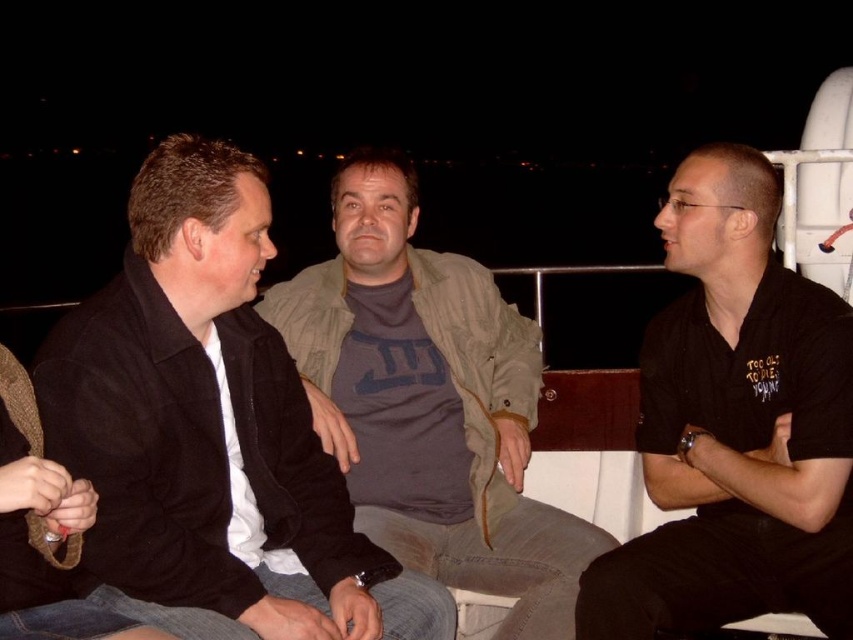
Question: Does black matte shirt at center appear under dark gray cotton shirt at center?

Choices:
 (A) yes
 (B) no

Answer: (B)

Question: Can you confirm if black matte jacket at left is positioned above black matte shirt at center?

Choices:
 (A) yes
 (B) no

Answer: (B)

Question: Which point is farther from the camera taking this photo?

Choices:
 (A) (381, 481)
 (B) (167, 237)
 (C) (808, 605)

Answer: (A)

Question: Which object is closer to the camera taking this photo?

Choices:
 (A) dark gray cotton shirt at center
 (B) black matte jacket at left

Answer: (B)

Question: Is black matte shirt at center positioned before dark gray cotton shirt at center?

Choices:
 (A) yes
 (B) no

Answer: (A)

Question: Which of the following is the farthest from the observer?

Choices:
 (A) (479, 419)
 (B) (352, 579)
 (C) (805, 316)

Answer: (A)